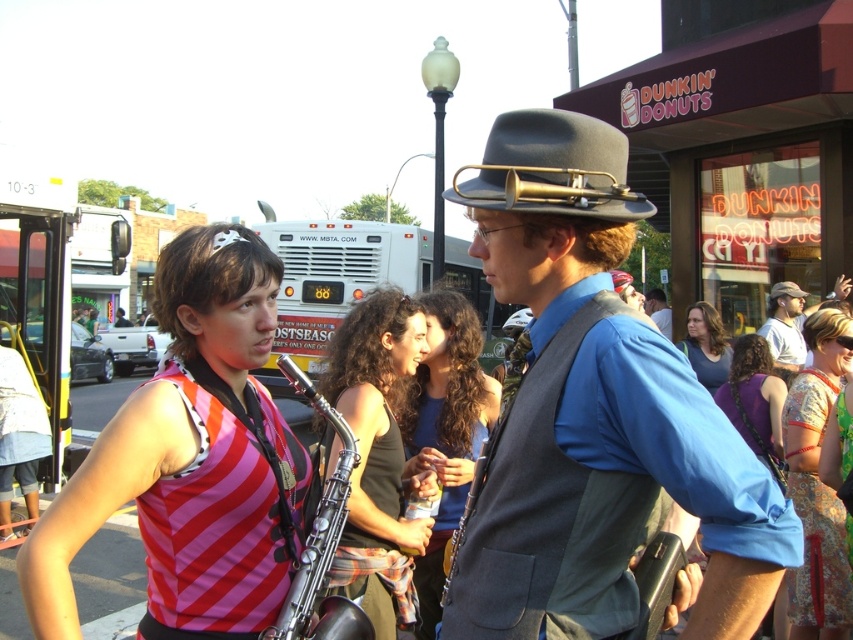
Question: Can you confirm if white matte bus at center is bigger than purple fabric dress at center?

Choices:
 (A) yes
 (B) no

Answer: (B)

Question: Estimate the real-world distances between objects in this image. Which object is closer to the matte gray hat at center?

Choices:
 (A) matte gray tank top at center
 (B) matte blue shirt at center
 (C) silver metallic saxophone at center
 (D) light gray fabric cap at center

Answer: (C)

Question: Does matte gray hat at center appear under white matte bus at center?

Choices:
 (A) yes
 (B) no

Answer: (A)

Question: Which of the following is the farthest from the observer?

Choices:
 (A) click(x=827, y=387)
 (B) click(x=163, y=545)
 (C) click(x=395, y=304)

Answer: (A)

Question: Can you confirm if matte green shirt at center is bigger than white plastic bus at left?

Choices:
 (A) no
 (B) yes

Answer: (B)

Question: Which is farther from the white matte bus at center?

Choices:
 (A) matte gray plug hat at center
 (B) matte gray hat at center
 (C) matte green shirt at center
 (D) light gray fabric cap at center

Answer: (B)